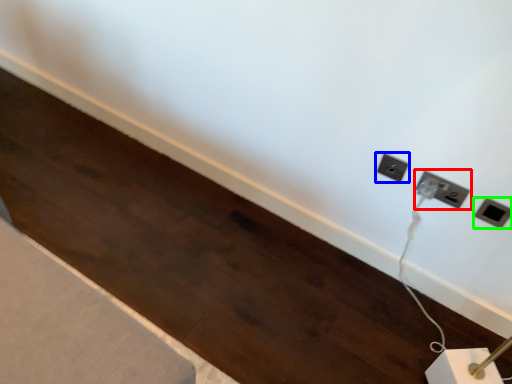
Question: Which object is positioned farthest from power plugs and sockets (highlighted by a red box)? Select from power plugs and sockets (highlighted by a blue box) and power plugs and sockets (highlighted by a green box).

Choices:
 (A) power plugs and sockets
 (B) power plugs and sockets

Answer: (A)